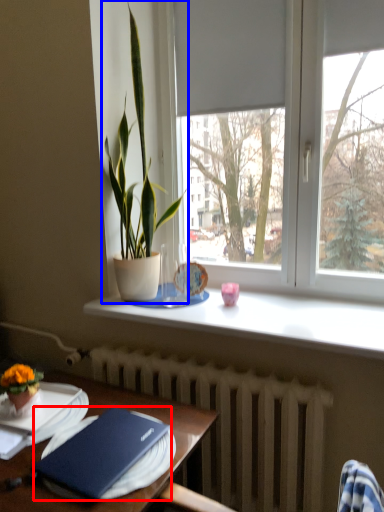
Question: Which point is closer to the camera, hardback book (highlighted by a red box) or houseplant (highlighted by a blue box)?

Choices:
 (A) hardback book
 (B) houseplant

Answer: (A)